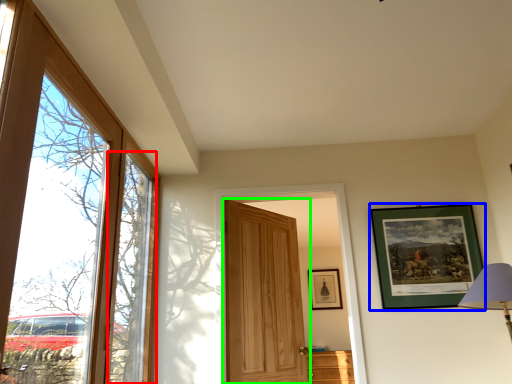
Question: Estimate the real-world distances between objects in this image. Which object is farther from window (highlighted by a red box), picture frame (highlighted by a blue box) or door (highlighted by a green box)?

Choices:
 (A) picture frame
 (B) door

Answer: (A)